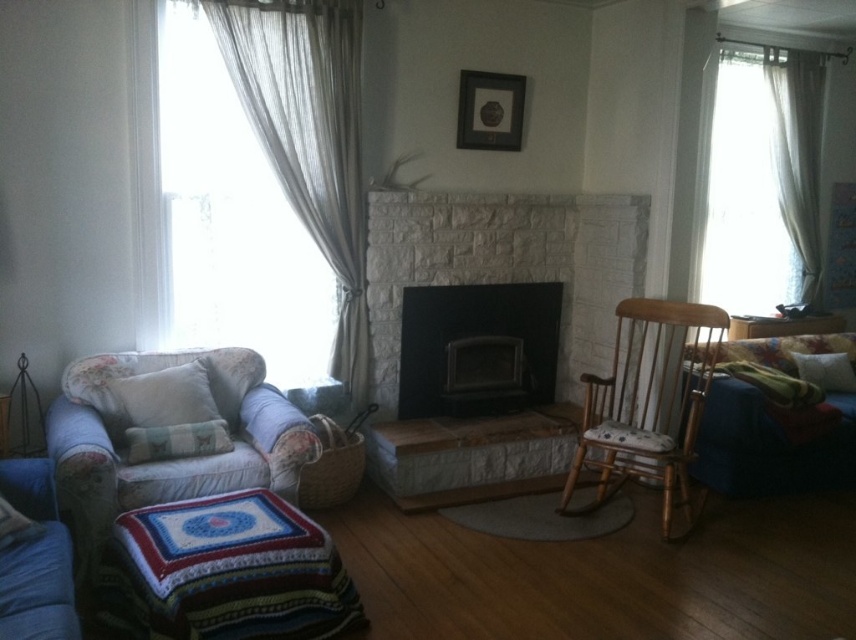
Question: Is white sheer curtains at upper right to the right of white sheer curtain at right from the viewer's perspective?

Choices:
 (A) no
 (B) yes

Answer: (A)

Question: Is sheer fabric curtain at left wider than wooden rocking chair at right?

Choices:
 (A) no
 (B) yes

Answer: (A)

Question: Can you confirm if floral fabric couch at left is positioned above fluffy white pillow at left?

Choices:
 (A) yes
 (B) no

Answer: (A)

Question: Which point is closer to the camera?

Choices:
 (A) 490,84
 (B) 421,406

Answer: (A)

Question: Which of the following is the closest to the observer?

Choices:
 (A) white fabric pillow at left
 (B) white sheer curtain at right
 (C) fluffy white pillow at left

Answer: (C)

Question: Which is nearer to the wooden rocking chair at right?

Choices:
 (A) black stone fireplace at center
 (B) white sheer curtain at right
 (C) denim fabric couch at lower left
 (D) white soft pillow at right

Answer: (A)